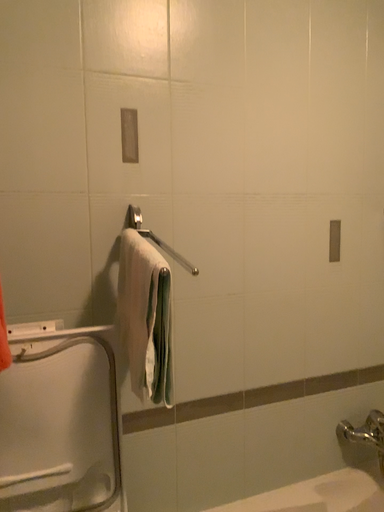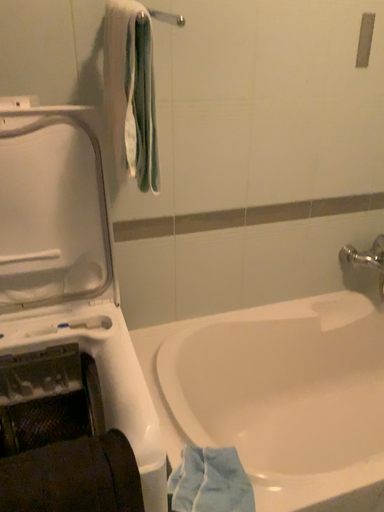
Question: How did the camera likely rotate when shooting the video?

Choices:
 (A) rotated upward
 (B) rotated downward

Answer: (B)